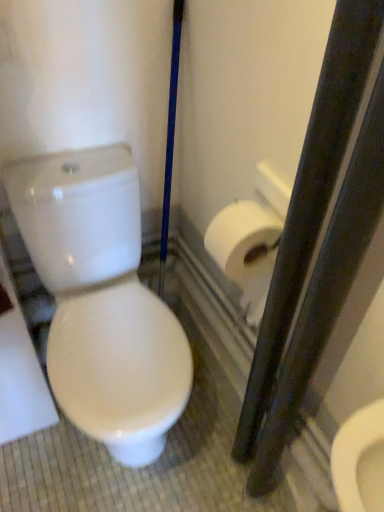
Question: Considering the positions of white glossy toilet at left and white matte toilet paper at right in the image, is white glossy toilet at left wider or thinner than white matte toilet paper at right?

Choices:
 (A) wide
 (B) thin

Answer: (A)

Question: Does point (140, 442) appear closer or farther from the camera than point (278, 221)?

Choices:
 (A) farther
 (B) closer

Answer: (A)

Question: From their relative heights in the image, would you say white glossy toilet at left is taller or shorter than white matte toilet paper at right?

Choices:
 (A) short
 (B) tall

Answer: (B)

Question: Is point (218, 248) positioned closer to the camera than point (79, 320)?

Choices:
 (A) farther
 (B) closer

Answer: (B)

Question: Is white matte toilet paper at right in front of or behind white glossy toilet at left in the image?

Choices:
 (A) front
 (B) behind

Answer: (B)

Question: Is white matte toilet paper at right taller or shorter than white glossy toilet at left?

Choices:
 (A) tall
 (B) short

Answer: (B)

Question: In terms of size, does white matte toilet paper at right appear bigger or smaller than white glossy toilet at left?

Choices:
 (A) big
 (B) small

Answer: (B)